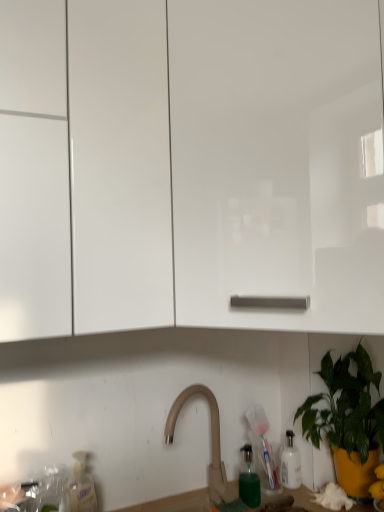
Describe the element at coordinates (86, 172) in the screenshot. I see `white glossy cabinet at upper left, the first cabinetry from the left` at that location.

The width and height of the screenshot is (384, 512). Find the location of `transparent plastic bottle at lower left`. transparent plastic bottle at lower left is located at coordinates (x=82, y=485).

Describe the element at coordinates (211, 439) in the screenshot. The image size is (384, 512). I see `beige matte faucet at center` at that location.

I want to click on white glossy cabinet at upper left, the first cabinetry from the left, so click(x=86, y=172).

How many degrees apart are the facing directions of white matte cabinet at center, which is counted as the 2th cabinetry, starting from the left, and beige matte faucet at center?

The angular difference between white matte cabinet at center, which is counted as the 2th cabinetry, starting from the left, and beige matte faucet at center is 44.6 degrees.

Considering the relative positions of white matte cabinet at center, which is counted as the 2th cabinetry, starting from the left, and beige matte faucet at center in the image provided, is white matte cabinet at center, which is counted as the 2th cabinetry, starting from the left, to the left or to the right of beige matte faucet at center?

From the image, it's evident that white matte cabinet at center, which is counted as the 2th cabinetry, starting from the left, is to the right of beige matte faucet at center.

Measure the distance from white matte cabinet at center, which ranks as the 1th cabinetry in right-to-left order, to beige matte faucet at center.

A distance of 76.50 centimeters exists between white matte cabinet at center, which ranks as the 1th cabinetry in right-to-left order, and beige matte faucet at center.

Consider the image. From the image's perspective, is white matte cabinet at center, which is counted as the 2th cabinetry, starting from the left, over beige matte faucet at center?

Yes.

Is white glossy cabinet at upper left, arranged as the 2th cabinetry when viewed from the right, not close to green glossy plant at lower right?

No, there isn't a large distance between white glossy cabinet at upper left, arranged as the 2th cabinetry when viewed from the right, and green glossy plant at lower right.

From a real-world perspective, is white glossy cabinet at upper left, the first cabinetry from the left, beneath green glossy plant at lower right?

Incorrect, from a real-world perspective, white glossy cabinet at upper left, the first cabinetry from the left, is higher than green glossy plant at lower right.

Considering the sizes of objects white glossy cabinet at upper left, arranged as the 2th cabinetry when viewed from the right, and green glossy plant at lower right in the image provided, who is smaller, white glossy cabinet at upper left, arranged as the 2th cabinetry when viewed from the right, or green glossy plant at lower right?

With smaller size is green glossy plant at lower right.

Between white glossy cabinet at upper left, arranged as the 2th cabinetry when viewed from the right, and green glossy plant at lower right, which one has less height?

With less height is green glossy plant at lower right.

Can you confirm if white matte cabinet at center, which ranks as the 1th cabinetry in right-to-left order, is taller than white glossy cabinet at upper left, the first cabinetry from the left?

No.

Considering the positions of objects white matte cabinet at center, which ranks as the 1th cabinetry in right-to-left order, and white glossy cabinet at upper left, arranged as the 2th cabinetry when viewed from the right, in the image provided, who is more to the right, white matte cabinet at center, which ranks as the 1th cabinetry in right-to-left order, or white glossy cabinet at upper left, arranged as the 2th cabinetry when viewed from the right,?

Positioned to the right is white matte cabinet at center, which ranks as the 1th cabinetry in right-to-left order.

Looking at this image, what's the angular difference between white matte cabinet at center, which is counted as the 2th cabinetry, starting from the left, and white glossy cabinet at upper left, the first cabinetry from the left,'s facing directions?

They differ by 44.6 degrees in their facing directions.

Is white glossy cabinet at upper left, the first cabinetry from the left, to the left of beige matte faucet at center from the viewer's perspective?

Correct, you'll find white glossy cabinet at upper left, the first cabinetry from the left, to the left of beige matte faucet at center.

Considering the relative sizes of white glossy cabinet at upper left, arranged as the 2th cabinetry when viewed from the right, and beige matte faucet at center in the image provided, is white glossy cabinet at upper left, arranged as the 2th cabinetry when viewed from the right, taller than beige matte faucet at center?

Yes, white glossy cabinet at upper left, arranged as the 2th cabinetry when viewed from the right, is taller than beige matte faucet at center.

Measure the distance between white glossy cabinet at upper left, the first cabinetry from the left, and beige matte faucet at center.

white glossy cabinet at upper left, the first cabinetry from the left, is 29.57 inches from beige matte faucet at center.

From a real-world perspective, which is physically above, white glossy cabinet at upper left, arranged as the 2th cabinetry when viewed from the right, or beige matte faucet at center?

white glossy cabinet at upper left, arranged as the 2th cabinetry when viewed from the right, from a real-world perspective.

Is transparent plastic bottle at lower left positioned behind green glossy plant at lower right?

Yes.

Is transparent plastic bottle at lower left shorter than green glossy plant at lower right?

Correct, transparent plastic bottle at lower left is not as tall as green glossy plant at lower right.

Considering the relative sizes of transparent plastic bottle at lower left and green glossy plant at lower right in the image provided, is transparent plastic bottle at lower left wider than green glossy plant at lower right?

No.

Is white matte cabinet at center, which is counted as the 2th cabinetry, starting from the left, located within beige matte faucet at center?

No.

Is beige matte faucet at center facing away from white matte cabinet at center, which is counted as the 2th cabinetry, starting from the left?

No, white matte cabinet at center, which is counted as the 2th cabinetry, starting from the left, is not at the back of beige matte faucet at center.

Consider the image. Is beige matte faucet at center positioned before white matte cabinet at center, which is counted as the 2th cabinetry, starting from the left?

No, beige matte faucet at center is behind white matte cabinet at center, which is counted as the 2th cabinetry, starting from the left.

Can you see green glossy plant at lower right touching white matte cabinet at center, which is counted as the 2th cabinetry, starting from the left?

They are not placed beside each other.

Is green glossy plant at lower right shorter than white matte cabinet at center, which is counted as the 2th cabinetry, starting from the left?

Yes, green glossy plant at lower right is shorter than white matte cabinet at center, which is counted as the 2th cabinetry, starting from the left.

From a real-world perspective, is green glossy plant at lower right physically below white matte cabinet at center, which ranks as the 1th cabinetry in right-to-left order?

Yes, from a real-world perspective, green glossy plant at lower right is beneath white matte cabinet at center, which ranks as the 1th cabinetry in right-to-left order.

Is white matte cabinet at center, which ranks as the 1th cabinetry in right-to-left order, at the back of green glossy plant at lower right?

green glossy plant at lower right is not turned away from white matte cabinet at center, which ranks as the 1th cabinetry in right-to-left order.

At what (x,y) coordinates should I click in order to perform the action: click on the 2nd cabinetry in front when counting from the beige matte faucet at center. Please return your answer as a coordinate pair (x, y). Looking at the image, I should click on (191, 165).

Locate an element on the screen. The image size is (384, 512). houseplant behind the white glossy cabinet at upper left, arranged as the 2th cabinetry when viewed from the right is located at coordinates (347, 419).

Considering their positions, is white matte cabinet at center, which ranks as the 1th cabinetry in right-to-left order, positioned further to beige matte faucet at center than transparent plastic bottle at lower left?

white matte cabinet at center, which ranks as the 1th cabinetry in right-to-left order, lies further to beige matte faucet at center than the other object.

Consider the image. Considering their positions, is white glossy cabinet at upper left, the first cabinetry from the left, positioned closer to green glossy plant at lower right than transparent plastic bottle at lower left?

transparent plastic bottle at lower left is closer to green glossy plant at lower right.

Considering their positions, is white glossy cabinet at upper left, the first cabinetry from the left, positioned closer to white matte cabinet at center, which is counted as the 2th cabinetry, starting from the left, than beige matte faucet at center?

white glossy cabinet at upper left, the first cabinetry from the left, is closer to white matte cabinet at center, which is counted as the 2th cabinetry, starting from the left.

Estimate the real-world distances between objects in this image. Which object is closer to white glossy cabinet at upper left, arranged as the 2th cabinetry when viewed from the right, green glossy plant at lower right or transparent plastic bottle at lower left?

The object closer to white glossy cabinet at upper left, arranged as the 2th cabinetry when viewed from the right, is transparent plastic bottle at lower left.

Which object lies further to the anchor point transparent plastic bottle at lower left, white glossy cabinet at upper left, the first cabinetry from the left, or white matte cabinet at center, which is counted as the 2th cabinetry, starting from the left?

The object further to transparent plastic bottle at lower left is white matte cabinet at center, which is counted as the 2th cabinetry, starting from the left.

From the image, which object appears to be farther from white matte cabinet at center, which is counted as the 2th cabinetry, starting from the left, white glossy cabinet at upper left, arranged as the 2th cabinetry when viewed from the right, or green glossy plant at lower right?

green glossy plant at lower right lies further to white matte cabinet at center, which is counted as the 2th cabinetry, starting from the left, than the other object.

Looking at the image, which one is located further to green glossy plant at lower right, white matte cabinet at center, which ranks as the 1th cabinetry in right-to-left order, or beige matte faucet at center?

white matte cabinet at center, which ranks as the 1th cabinetry in right-to-left order, is positioned further to the anchor green glossy plant at lower right.

Estimate the real-world distances between objects in this image. Which object is closer to white glossy cabinet at upper left, arranged as the 2th cabinetry when viewed from the right, white matte cabinet at center, which ranks as the 1th cabinetry in right-to-left order, or transparent plastic bottle at lower left?

white matte cabinet at center, which ranks as the 1th cabinetry in right-to-left order, is closer to white glossy cabinet at upper left, arranged as the 2th cabinetry when viewed from the right.

Image resolution: width=384 pixels, height=512 pixels. Identify the location of cabinetry between white matte cabinet at center, which is counted as the 2th cabinetry, starting from the left, and green glossy plant at lower right in the up-down direction. (86, 172).

Locate an element on the screen. The image size is (384, 512). houseplant that lies between white matte cabinet at center, which ranks as the 1th cabinetry in right-to-left order, and transparent plastic bottle at lower left from top to bottom is located at coordinates (347, 419).

Locate an element on the screen. cabinetry between white matte cabinet at center, which ranks as the 1th cabinetry in right-to-left order, and beige matte faucet at center from top to bottom is located at coordinates (86, 172).

At what (x,y) coordinates should I click in order to perform the action: click on houseplant that lies between white matte cabinet at center, which ranks as the 1th cabinetry in right-to-left order, and beige matte faucet at center from top to bottom. Please return your answer as a coordinate pair (x, y). This screenshot has width=384, height=512. Looking at the image, I should click on (347, 419).